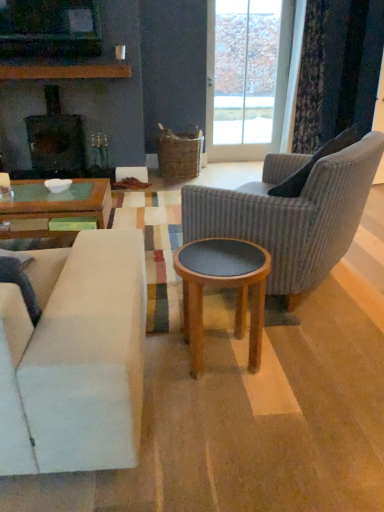
The image size is (384, 512). Identify the location of vacant region under wooden round stool at center (from a real-world perspective). (218, 356).